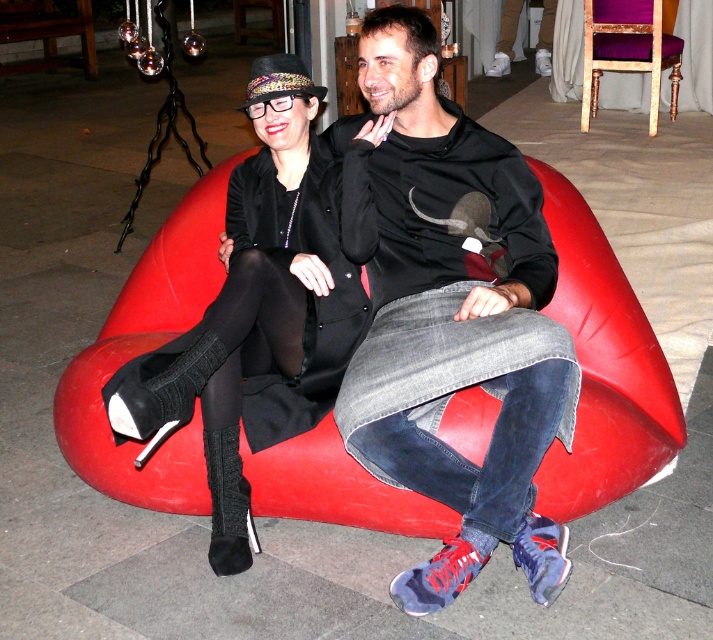
You are standing in the room where the two people are sitting on the red fabric bean bag at center. You want to place a small decorative pillow exactly at the point marked by the coordinates given. Is the point marked by point (602, 369) located on the red fabric bean bag at center?

Yes, the point (602, 369) is located on the red fabric bean bag at center as stated in the objects description.

You are standing at point 0.5, 0.8 in the image coordinate system. You want to move to the red fabric bean bag at center. In which direction should you move to reach it?

The red fabric bean bag at center is located at point (x=602, y=369). Since you are at (x=570, y=320), you need to move northeast to reach it because the bean bag is northeast of your current position.